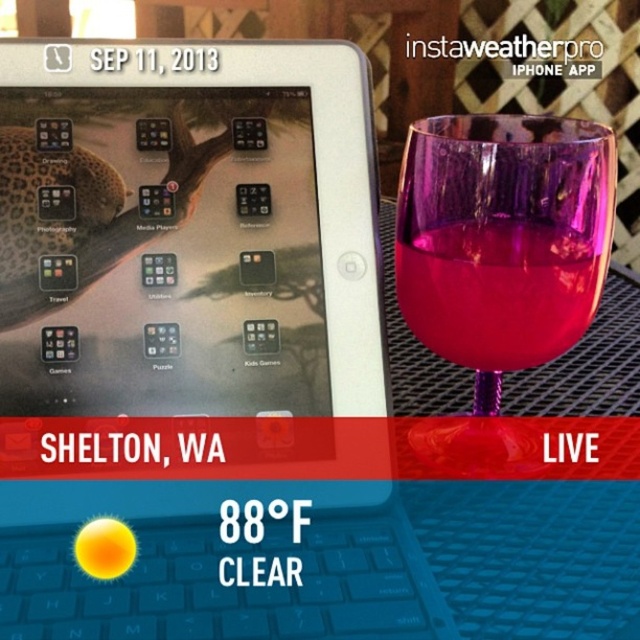
Looking at this image, does satin silver laptop at center have a greater height compared to transparent purple wine glass at right?

Indeed, satin silver laptop at center has a greater height compared to transparent purple wine glass at right.

Is point (376, 312) farther from camera compared to point (486, 429)?

No, (376, 312) is in front of (486, 429).

At what (x,y) coordinates should I click in order to perform the action: click on satin silver laptop at center. Please return your answer as a coordinate pair (x, y). The width and height of the screenshot is (640, 640). Looking at the image, I should click on (188, 253).

Can you confirm if satin silver laptop at center is taller than transparent glass at right?

Yes.

Measure the distance from satin silver laptop at center to transparent glass at right.

The distance of satin silver laptop at center from transparent glass at right is 3.33 inches.

Locate an element on the screen. satin silver laptop at center is located at coordinates click(188, 253).

Image resolution: width=640 pixels, height=640 pixels. I want to click on satin silver laptop at center, so (188, 253).

Does transparent purple wine glass at right appear on the left side of transparent glass at right?

Incorrect, transparent purple wine glass at right is not on the left side of transparent glass at right.

Who is more forward, (605,256) or (580,332)?

Positioned in front is point (605,256).

What do you see at coordinates (499, 262) in the screenshot? I see `transparent purple wine glass at right` at bounding box center [499, 262].

Find the location of a particular element. transparent purple wine glass at right is located at coordinates (499, 262).